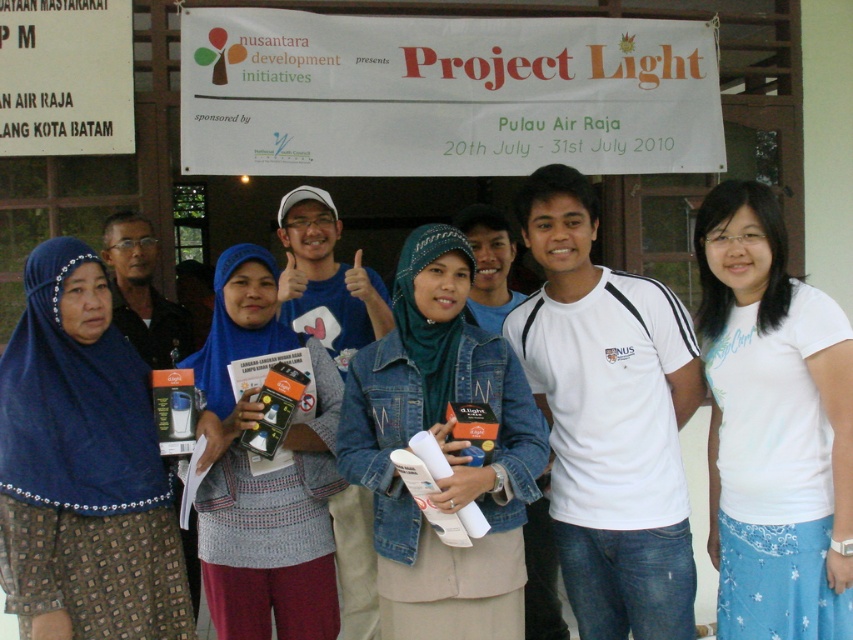
Based on the scene description, where is the denim jacket at center located in terms of its 2D coordinates?

The denim jacket at center is located at the 2D coordinates point (442, 451).